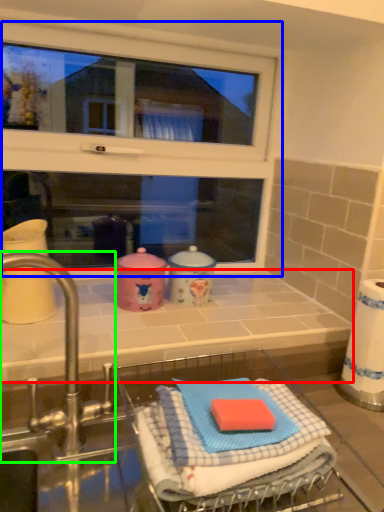
Question: Estimate the real-world distances between objects in this image. Which object is farther from counter top (highlighted by a red box), window (highlighted by a blue box) or tap (highlighted by a green box)?

Choices:
 (A) window
 (B) tap

Answer: (A)